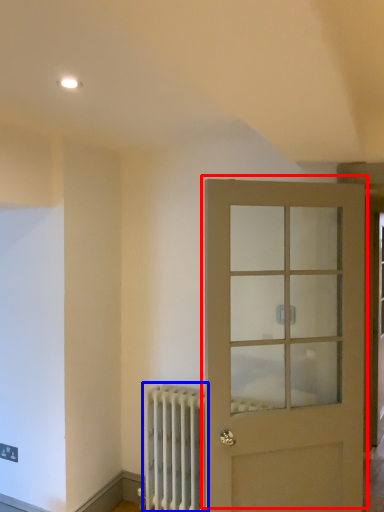
Question: Which of the following is the farthest to the observer, door (highlighted by a red box) or radiator (highlighted by a blue box)?

Choices:
 (A) door
 (B) radiator

Answer: (B)